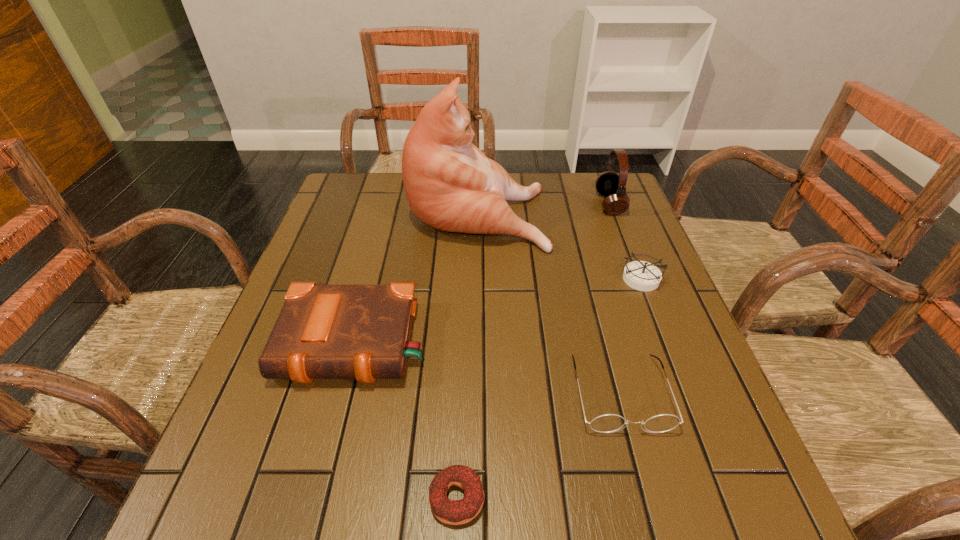
This screenshot has width=960, height=540. I want to click on free spot between the tallest object and the spectacles, so click(549, 302).

This screenshot has width=960, height=540. Find the location of `free space between the nearest object and the spectacles`. free space between the nearest object and the spectacles is located at coordinates (539, 446).

Where is `free spot between the headset and the nearest object`? free spot between the headset and the nearest object is located at coordinates (533, 351).

Where is `vacant area that lies between the fourth nearest object and the tallest object`? The height and width of the screenshot is (540, 960). vacant area that lies between the fourth nearest object and the tallest object is located at coordinates (559, 245).

Locate an element on the screen. Image resolution: width=960 pixels, height=540 pixels. vacant point located between the fourth shortest object and the spectacles is located at coordinates (488, 368).

The width and height of the screenshot is (960, 540). I want to click on free space between the headset and the third tallest object, so click(x=483, y=274).

This screenshot has height=540, width=960. Find the location of `empty space between the shortest object and the compass`. empty space between the shortest object and the compass is located at coordinates (548, 388).

Locate an element on the screen. vacant space that's between the nearest object and the spectacles is located at coordinates (539, 446).

Locate an element on the screen. The width and height of the screenshot is (960, 540). free point between the headset and the fourth nearest object is located at coordinates (625, 241).

Select which object is the second closest to the second tallest object. Please provide its 2D coordinates. Your answer should be formatted as a tuple, i.e. [(x, y)], where the tuple contains the x and y coordinates of a point satisfying the conditions above.

[(640, 275)]